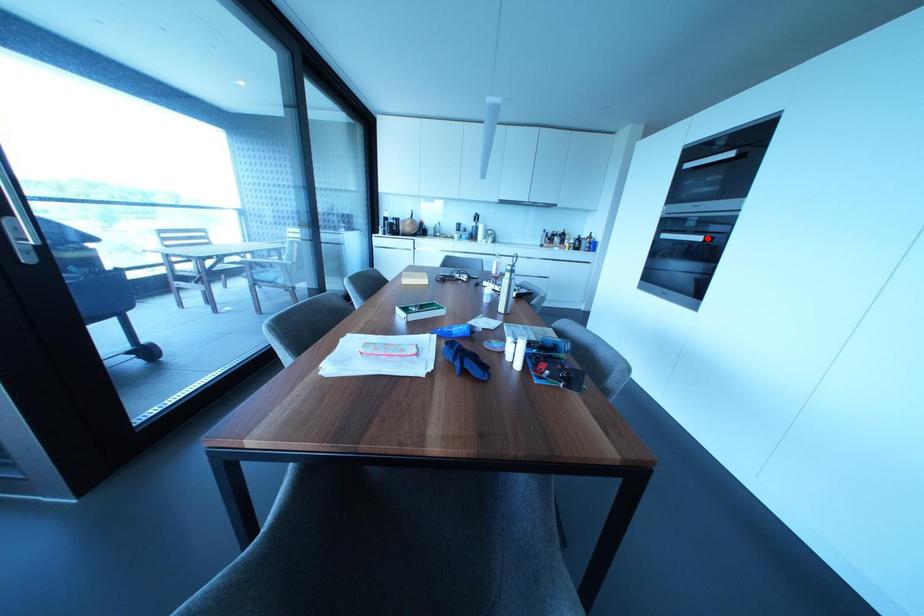
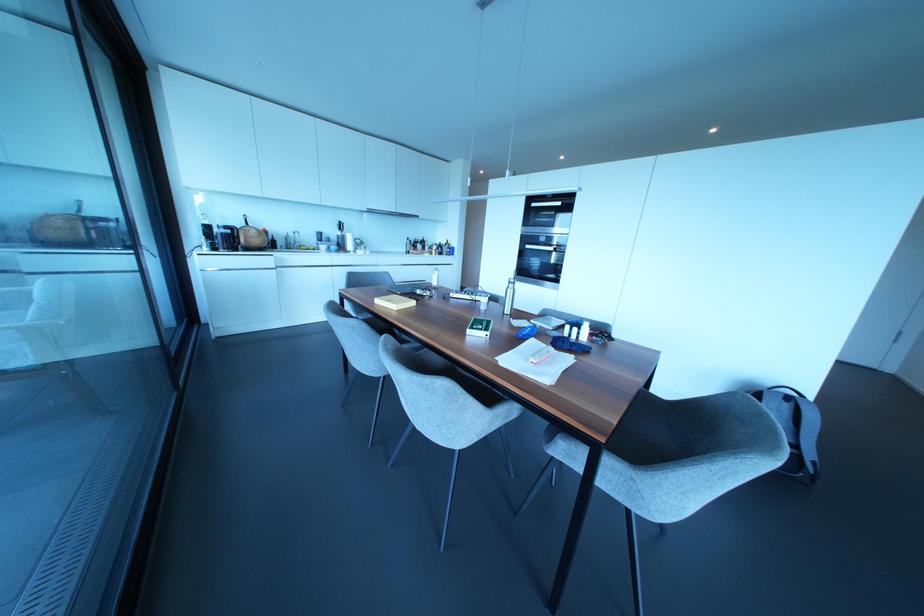
Question: I am providing you with two images of the same scene from different viewpoints. Image1 has a red point marked. In image2, the corresponding 3D location appears at what relative position? Reply with the corresponding letter.

Choices:
 (A) Closer
 (B) Farther

Answer: (A)